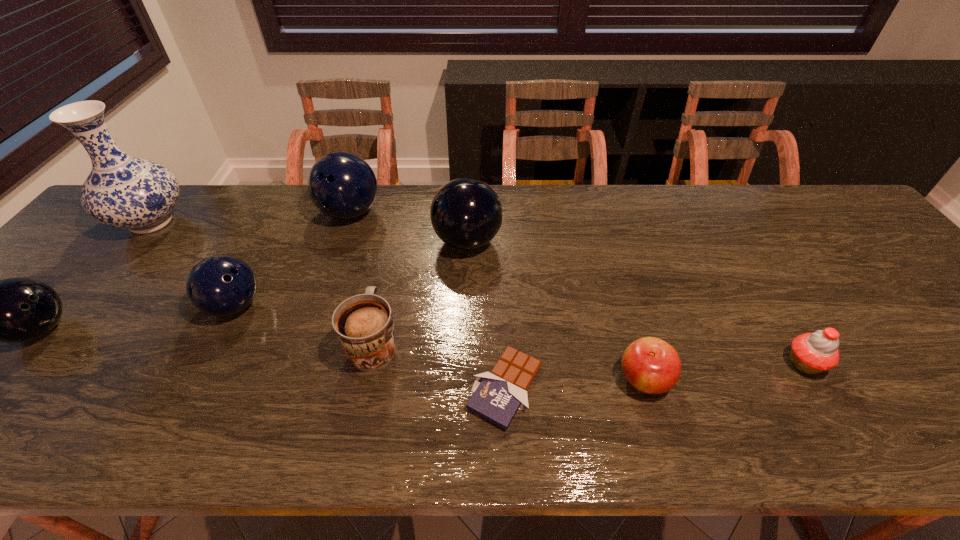
At what (x,y) coordinates should I click in order to perform the action: click on vase. Please return your answer as a coordinate pair (x, y). This screenshot has height=540, width=960. Looking at the image, I should click on (121, 191).

I want to click on blue vase, so click(x=121, y=191).

Identify the location of the bigger blue bowling ball. The height and width of the screenshot is (540, 960). (342, 185).

Identify the location of the farther blue bowling ball. The width and height of the screenshot is (960, 540). (342, 185).

This screenshot has height=540, width=960. Identify the location of the right black bowling ball. (466, 213).

Where is `the farther black bowling ball`? This screenshot has width=960, height=540. the farther black bowling ball is located at coordinates (466, 213).

You are a GUI agent. You are given a task and a screenshot of the screen. Output one action in this format:
    pyautogui.click(x=<x>, y=<y>)
    Task: Click on the left blue bowling ball
    
    Given the screenshot: What is the action you would take?
    pyautogui.click(x=221, y=285)

Identify the location of the third object from left to right. click(x=221, y=285).

Locate an element on the screen. mug is located at coordinates (364, 326).

The image size is (960, 540). In order to click on red cupcake in this screenshot , I will do `click(812, 353)`.